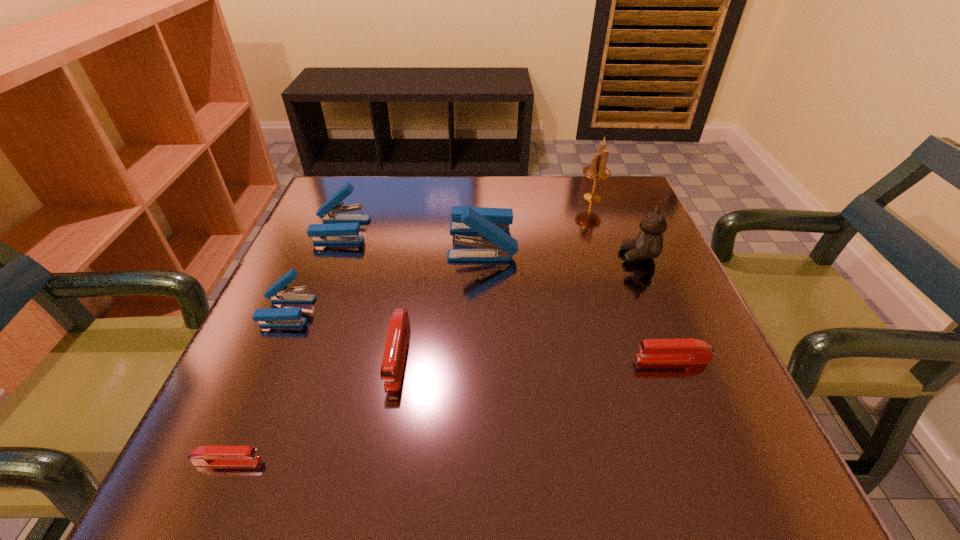
Find the location of a particular element. vacant area at the near right corner of the desktop is located at coordinates (738, 439).

Locate an element on the screen. free spot between the teddy bear and the rightmost blue stapler is located at coordinates pos(561,249).

Identify the location of unoccupied area between the second red stapler from left to right and the second biggest red stapler. (535, 356).

Identify the location of empty space that is in between the second stapler from right to left and the third shortest stapler. (440, 298).

At what (x,y) coordinates should I click in order to perform the action: click on free space that is in between the candle holder and the smallest blue stapler. Please return your answer as a coordinate pair (x, y). This screenshot has width=960, height=540. Looking at the image, I should click on (440, 254).

Where is `empty space that is in between the second biggest blue stapler and the tallest stapler`? The height and width of the screenshot is (540, 960). empty space that is in between the second biggest blue stapler and the tallest stapler is located at coordinates (412, 236).

I want to click on unoccupied position between the teddy bear and the tallest object, so click(615, 226).

The height and width of the screenshot is (540, 960). I want to click on vacant space that is in between the farthest object and the tallest stapler, so click(x=538, y=220).

Identify the location of free space between the fourth stapler from left to right and the brown teddy bear. The height and width of the screenshot is (540, 960). (518, 305).

This screenshot has height=540, width=960. Identify the location of object that ranks as the sixth closest to the fifth shortest object. (648, 245).